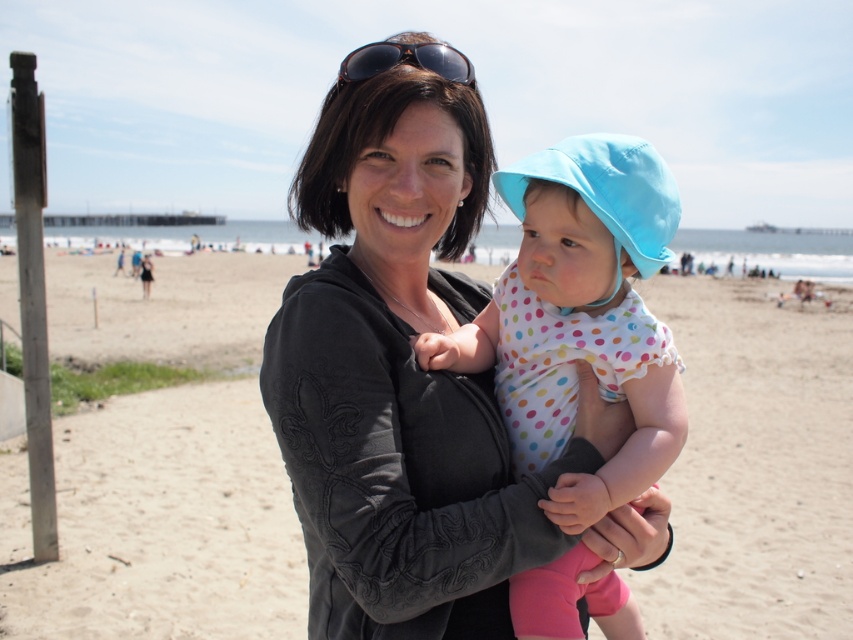
Is beige sand at center in front of brown textured sunglasses at upper center?

No, beige sand at center is further to the viewer.

The image size is (853, 640). Describe the element at coordinates (167, 465) in the screenshot. I see `beige sand at center` at that location.

Is point (77, 609) behind point (421, 65)?

Yes, it is behind point (421, 65).

Identify the location of beige sand at center. (167, 465).

Between beige sand at center and polka dot fabric sunsuit at center, which one is positioned lower?

Positioned lower is polka dot fabric sunsuit at center.

From the picture: Between beige sand at center and polka dot fabric sunsuit at center, which one is positioned higher?

beige sand at center

Find the location of a particular element. beige sand at center is located at coordinates (167, 465).

Can you confirm if polka dot fabric sunsuit at center is smaller than brown textured sunglasses at upper center?

Correct, polka dot fabric sunsuit at center occupies less space than brown textured sunglasses at upper center.

Does polka dot fabric sunsuit at center appear on the left side of brown textured sunglasses at upper center?

In fact, polka dot fabric sunsuit at center is to the right of brown textured sunglasses at upper center.

Is point (526, 230) closer to viewer compared to point (372, 58)?

No.

Find the location of a particular element. The image size is (853, 640). polka dot fabric sunsuit at center is located at coordinates (579, 316).